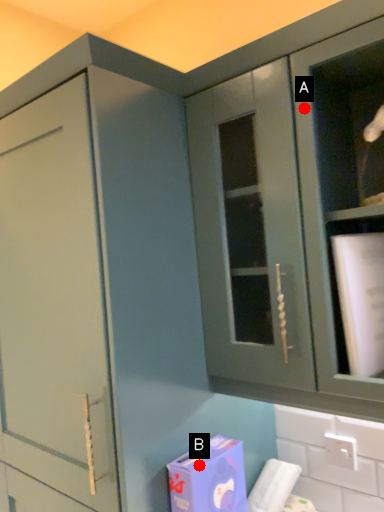
Question: Two points are circled on the image, labeled by A and B beside each circle. Which of the following is the farthest from the observer?

Choices:
 (A) A is further
 (B) B is further

Answer: (B)